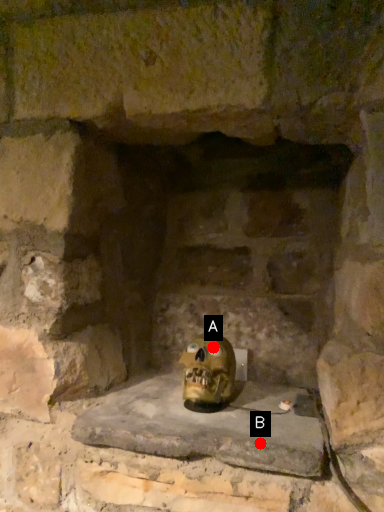
Question: Two points are circled on the image, labeled by A and B beside each circle. Among these points, which one is nearest to the camera?

Choices:
 (A) A is closer
 (B) B is closer

Answer: (B)